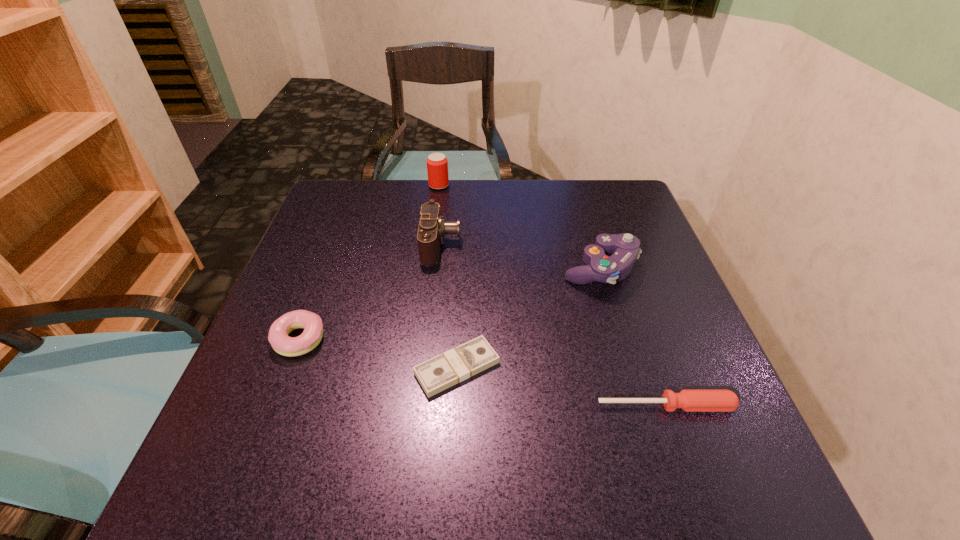
At what (x,y) coordinates should I click in order to perform the action: click on free spot that satisfies the following two spatial constraints: 1. on the back side of the shortest object; 2. on the front-facing side of the camera. Please return your answer as a coordinate pair (x, y). Looking at the image, I should click on (463, 244).

You are a GUI agent. You are given a task and a screenshot of the screen. Output one action in this format:
    pyautogui.click(x=<x>, y=<y>)
    Task: Click on the vacant area that satisfies the following two spatial constraints: 1. on the front-facing side of the camera; 2. on the back side of the control
    This screenshot has height=540, width=960.
    Given the screenshot: What is the action you would take?
    pyautogui.click(x=439, y=268)